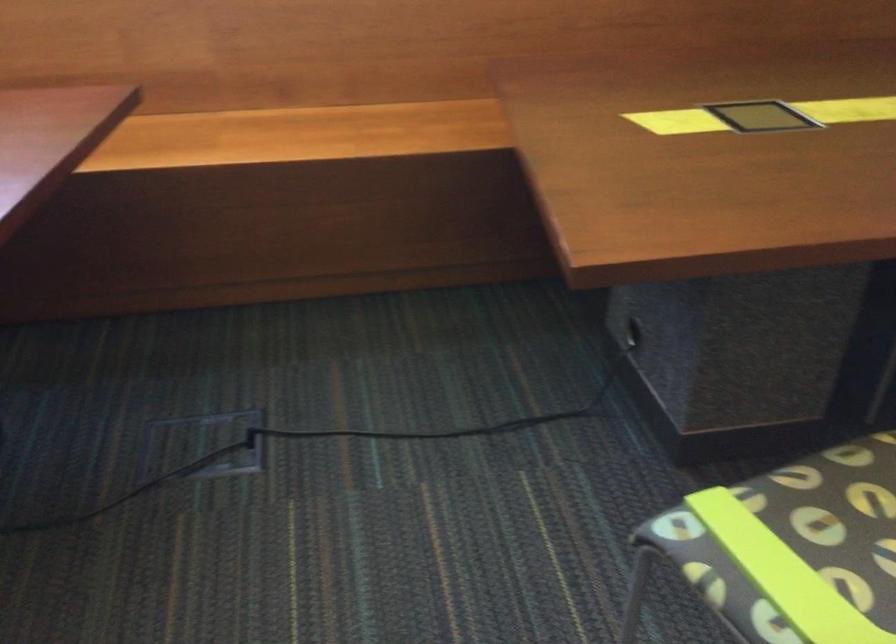
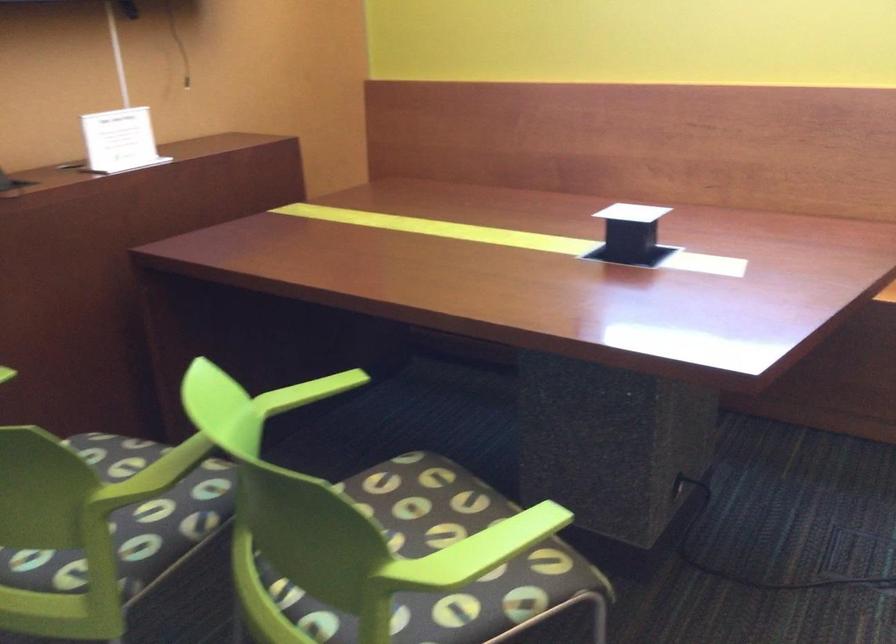
Question: The camera is either moving clockwise (left) or counter-clockwise (right) around the object. The first image is from the beginning of the video and the second image is from the end. Is the camera moving left or right when shooting the video?

Choices:
 (A) Left
 (B) Right

Answer: (B)